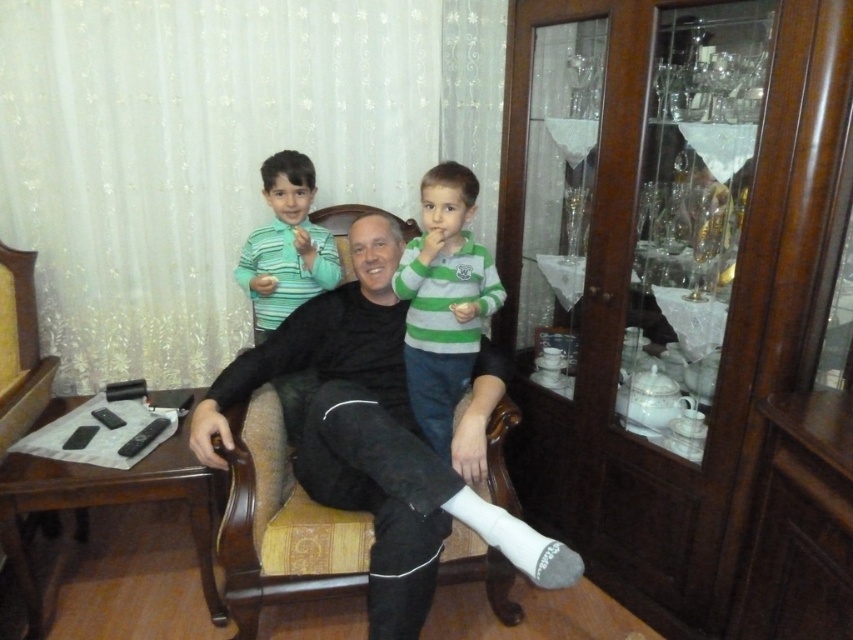
Which of these two, black matte shirt at center or green striped shirt at upper center, stands shorter?

Standing shorter between the two is green striped shirt at upper center.

The width and height of the screenshot is (853, 640). What are the coordinates of `black matte shirt at center` in the screenshot? It's located at (376, 435).

Is the position of green striped sweater at upper center more distant than that of green striped shirt at upper center?

No.

Which is more to the left, green striped sweater at upper center or green striped shirt at upper center?

Positioned to the left is green striped shirt at upper center.

This screenshot has height=640, width=853. Find the location of `green striped sweater at upper center`. green striped sweater at upper center is located at coordinates (444, 300).

Which is below, black matte shirt at center or green striped sweater at upper center?

black matte shirt at center is below.

Can you confirm if black matte shirt at center is positioned to the right of green striped sweater at upper center?

In fact, black matte shirt at center is to the left of green striped sweater at upper center.

Is point (437, 547) positioned behind point (444, 440)?

That is False.

The image size is (853, 640). Find the location of `black matte shirt at center`. black matte shirt at center is located at coordinates (376, 435).